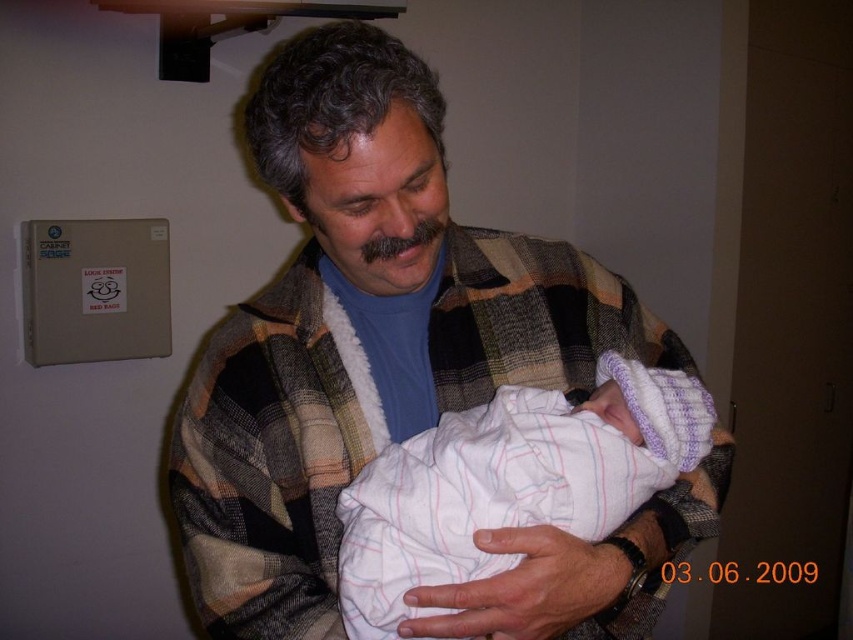
Is point (339, 29) less distant than point (349, 522)?

That is True.

Does point (485, 392) lie behind point (448, 566)?

Yes, it is behind point (448, 566).

Where is `plaid woolen shawl at center`? plaid woolen shawl at center is located at coordinates (361, 330).